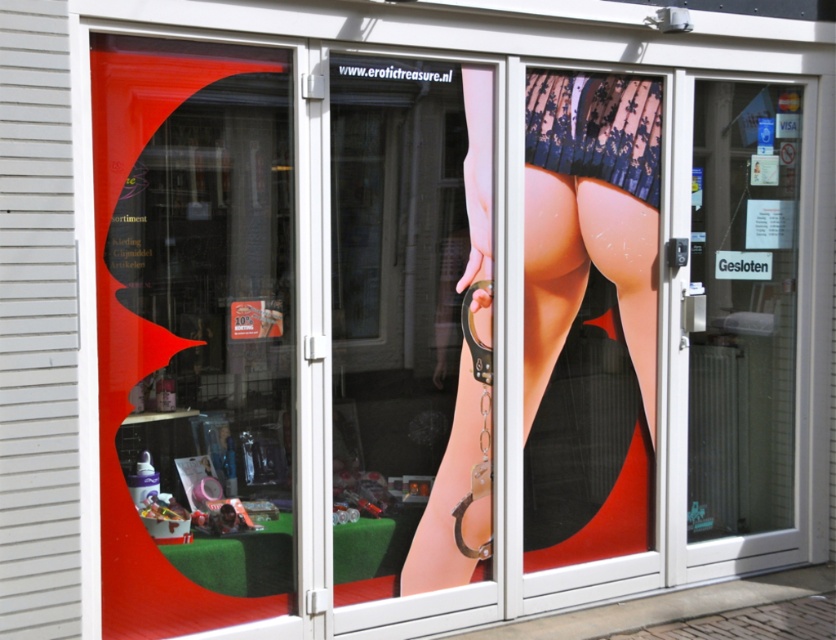
You are standing outside the shop and want to enter. The glass door has a white frame and is slightly ajar. There is a sign on the right side of the door at point (752, 317). Can you walk through the transparent glass door at center to enter the shop?

The transparent glass door at center is located at point (752, 317), so yes, you can walk through the transparent glass door at center to enter the shop since it is the door itself and is slightly ajar.

You are standing in front of the shop and want to enter. The glass door is slightly ajar. There is a point marked at coordinates (524,256) on the door. Can you reach this point to push the door open?

The distance of point (524,256) from camera is 14.61 feet, so you can reach it to push the door open since it is within a comfortable distance for a person standing in front of the shop.

You are a delivery person trying to enter the shop through the glass door. The door is slightly ajar. To open it fully, you need to know if the smooth skin at center is wider than the lacy black underwear at center. Can you confirm this?

The smooth skin at center has a larger width than the lacy black underwear at center, so yes, the smooth skin at center is wider than the lacy black underwear at center.